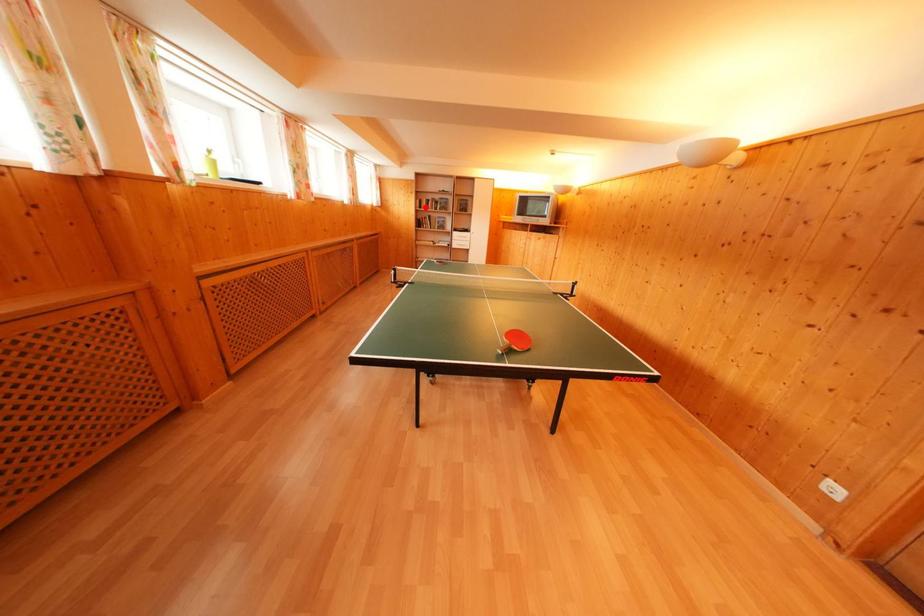
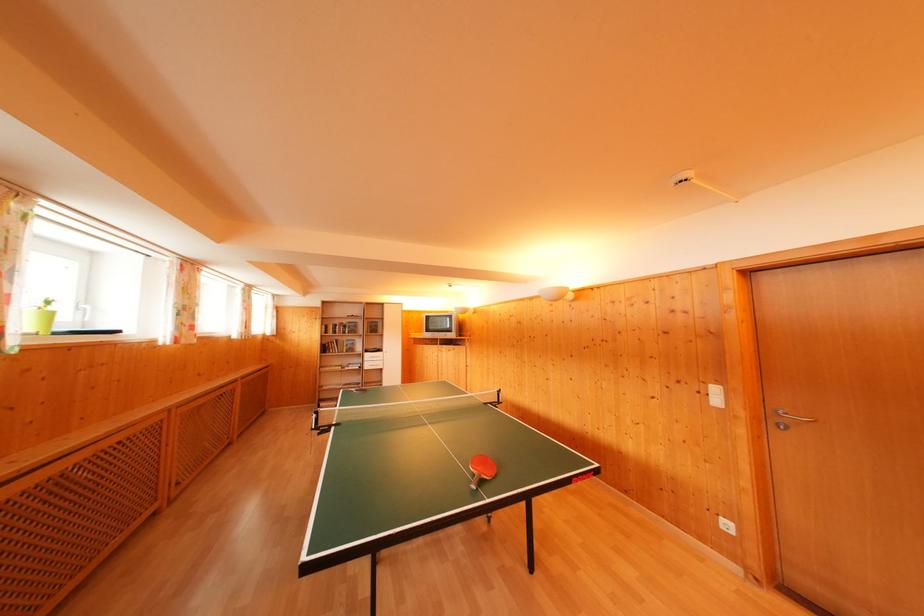
Question: I am providing you with two images of the same scene from different viewpoints. Given a red point in image1, look at the same physical point in image2. Is it:

Choices:
 (A) Closer to the viewpoint
 (B) Farther from the viewpoint

Answer: (B)